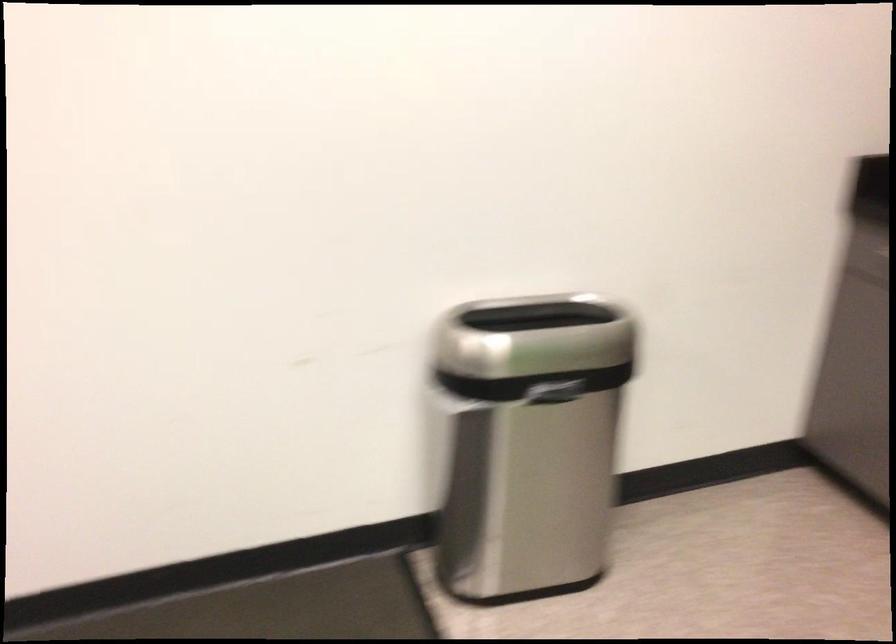
You are a GUI agent. You are given a task and a screenshot of the screen. Output one action in this format:
    pyautogui.click(x=<x>, y=<y>)
    Task: Click on the trash can opening
    The height and width of the screenshot is (644, 896).
    Given the screenshot: What is the action you would take?
    pyautogui.click(x=536, y=316)